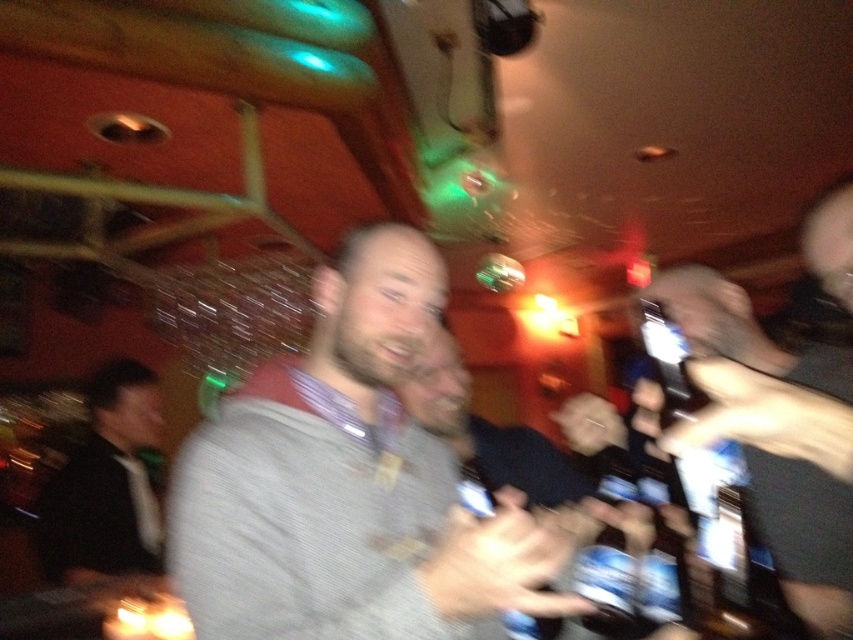
Question: Which object appears farthest from the camera in this image?

Choices:
 (A) clear plastic bottle at right
 (B) clear plastic bottle at center

Answer: (B)

Question: Does gray knitted sweater at center have a smaller size compared to clear plastic bottle at right?

Choices:
 (A) no
 (B) yes

Answer: (A)

Question: Considering the relative positions of gray knitted sweater at center and smooth plastic hand at center in the image provided, where is gray knitted sweater at center located with respect to smooth plastic hand at center?

Choices:
 (A) left
 (B) right

Answer: (A)

Question: Which of the following is the farthest from the observer?

Choices:
 (A) metallic silver phone at right
 (B) smooth leather jacket at right

Answer: (B)

Question: From the image, what is the correct spatial relationship of smooth leather jacket at right in relation to clear plastic bottle at right?

Choices:
 (A) right
 (B) left

Answer: (A)

Question: Considering the real-world distances, which object is closest to the clear plastic bottle at right?

Choices:
 (A) gray knitted sweater at center
 (B) clear plastic bottle at center

Answer: (B)